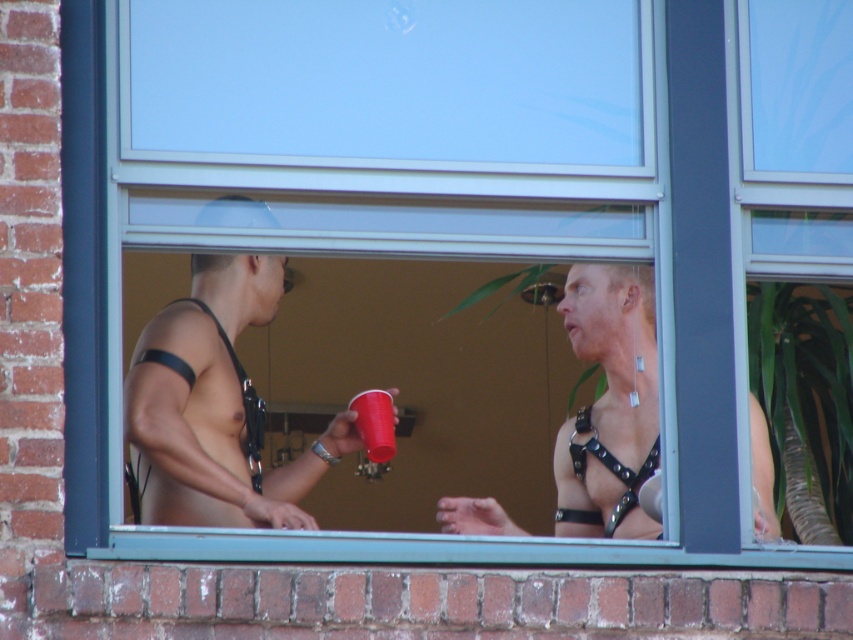
Looking at this image, is matte black harness at center wider than black leather harness at center?

Yes, matte black harness at center is wider than black leather harness at center.

Which is above, matte black harness at center or black leather harness at center?

Positioned higher is matte black harness at center.

Locate an element on the screen. Image resolution: width=853 pixels, height=640 pixels. matte black harness at center is located at coordinates (216, 406).

Does black leather harness at center have a lesser height compared to red plastic cup at center?

Incorrect, black leather harness at center's height does not fall short of red plastic cup at center's.

What do you see at coordinates (608, 404) in the screenshot?
I see `black leather harness at center` at bounding box center [608, 404].

Locate an element on the screen. The width and height of the screenshot is (853, 640). black leather harness at center is located at coordinates (608, 404).

In the scene shown: Can you confirm if matte black harness at center is thinner than red plastic cup at center?

Incorrect, matte black harness at center's width is not less than red plastic cup at center's.

Can you confirm if matte black harness at center is shorter than red plastic cup at center?

No, matte black harness at center is not shorter than red plastic cup at center.

Locate an element on the screen. The width and height of the screenshot is (853, 640). matte black harness at center is located at coordinates (216, 406).

Identify the location of matte black harness at center. The width and height of the screenshot is (853, 640). (216, 406).